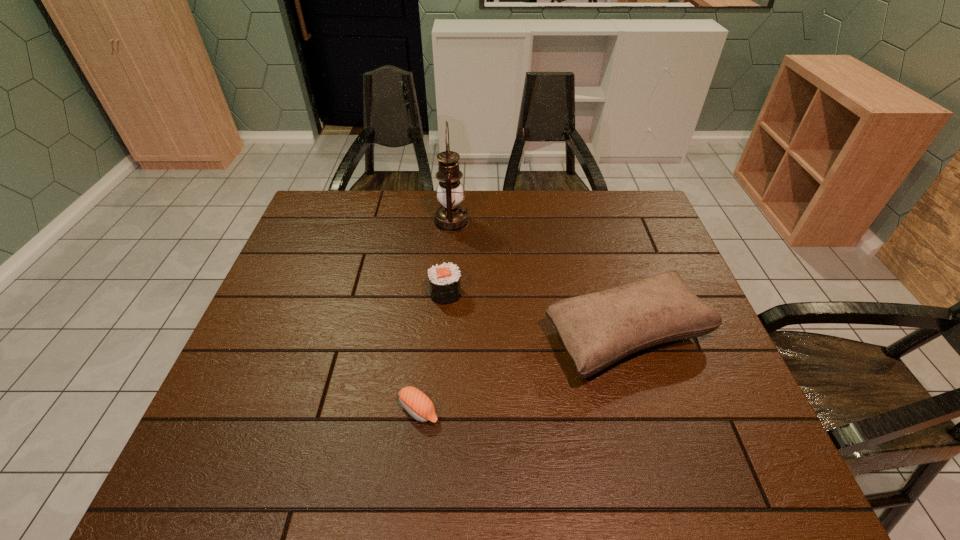
Identify the location of vacant space located on the left of the taller sushi. (403, 293).

Identify the location of vacant region located on the back of the nearest object. (429, 315).

Identify the location of object that is at the far edge. Image resolution: width=960 pixels, height=540 pixels. (451, 217).

Find the location of `object that is at the right edge`. object that is at the right edge is located at coordinates (598, 329).

The height and width of the screenshot is (540, 960). In order to click on free spot at the far edge of the desktop in this screenshot , I will do `click(520, 200)`.

This screenshot has width=960, height=540. In the image, there is a desktop. What are the coordinates of `blank space at the near edge` in the screenshot? It's located at (422, 447).

Identify the location of vacant area at the left edge of the desktop. The height and width of the screenshot is (540, 960). (297, 388).

I want to click on free region at the right edge of the desktop, so click(754, 440).

Image resolution: width=960 pixels, height=540 pixels. I want to click on blank area at the far left corner, so click(x=346, y=215).

In the image, there is a desktop. Where is `free space at the far right corner`? The height and width of the screenshot is (540, 960). free space at the far right corner is located at coordinates (611, 200).